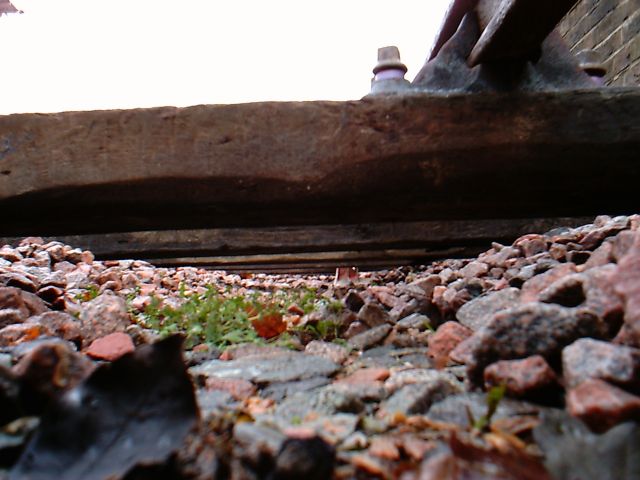
Where is `ledge`? ledge is located at coordinates (184, 129).